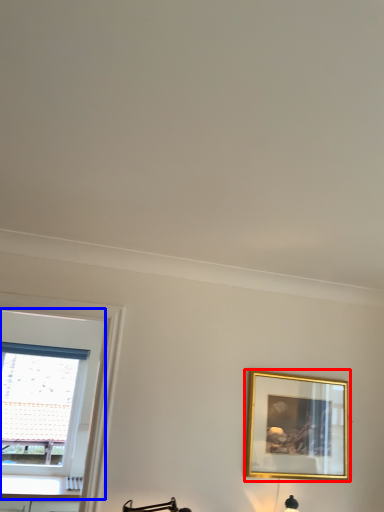
Question: Which point is closer to the camera, picture frame (highlighted by a red box) or window (highlighted by a blue box)?

Choices:
 (A) picture frame
 (B) window

Answer: (A)